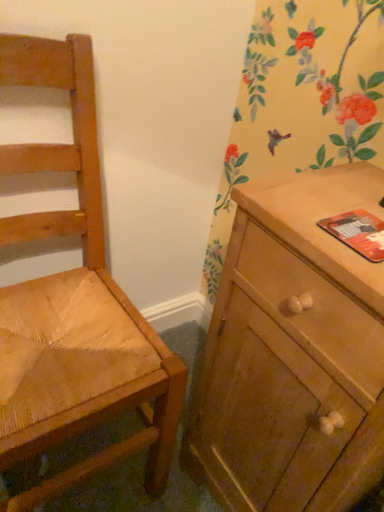
Question: From the image's perspective, is wooden cabinet at right on top of orange matte paperback book at right?

Choices:
 (A) yes
 (B) no

Answer: (B)

Question: Is wooden cabinet at right looking in the opposite direction of orange matte paperback book at right?

Choices:
 (A) yes
 (B) no

Answer: (B)

Question: Considering the relative positions of wooden cabinet at right and orange matte paperback book at right in the image provided, is wooden cabinet at right in front of orange matte paperback book at right?

Choices:
 (A) yes
 (B) no

Answer: (A)

Question: Does wooden cabinet at right lie behind orange matte paperback book at right?

Choices:
 (A) yes
 (B) no

Answer: (B)

Question: Considering the relative sizes of wooden cabinet at right and orange matte paperback book at right in the image provided, is wooden cabinet at right taller than orange matte paperback book at right?

Choices:
 (A) no
 (B) yes

Answer: (B)

Question: Is wooden cabinet at right facing towards orange matte paperback book at right?

Choices:
 (A) yes
 (B) no

Answer: (B)

Question: Is wooden cabinet at right taller than light brown woven wood chair at left?

Choices:
 (A) yes
 (B) no

Answer: (B)

Question: Are wooden cabinet at right and light brown woven wood chair at left making contact?

Choices:
 (A) yes
 (B) no

Answer: (B)

Question: Does wooden cabinet at right come behind light brown woven wood chair at left?

Choices:
 (A) no
 (B) yes

Answer: (B)

Question: From a real-world perspective, is wooden cabinet at right below light brown woven wood chair at left?

Choices:
 (A) no
 (B) yes

Answer: (B)

Question: Can you confirm if wooden cabinet at right is wider than light brown woven wood chair at left?

Choices:
 (A) no
 (B) yes

Answer: (A)

Question: Can you confirm if wooden cabinet at right is shorter than light brown woven wood chair at left?

Choices:
 (A) no
 (B) yes

Answer: (B)

Question: Can you confirm if orange matte paperback book at right is positioned to the right of light brown woven wood chair at left?

Choices:
 (A) no
 (B) yes

Answer: (B)